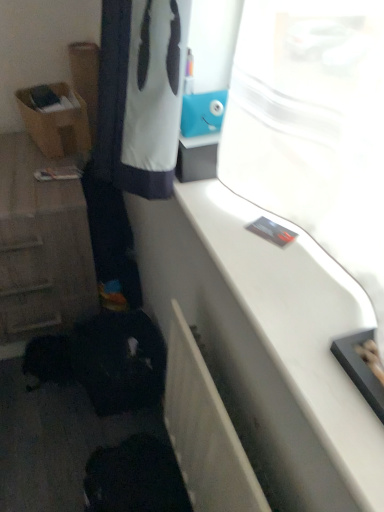
Question: Is point (1, 184) positioned closer to the camera than point (274, 349)?

Choices:
 (A) farther
 (B) closer

Answer: (A)

Question: From their relative heights in the image, would you say wooden cabinet at left is taller or shorter than white glossy counter top at upper right?

Choices:
 (A) tall
 (B) short

Answer: (A)

Question: Estimate the real-world distances between objects in this image. Which object is farther from the white glossy counter top at upper right?

Choices:
 (A) brown cardboard box at left
 (B) wooden cabinet at left

Answer: (A)

Question: Which object is positioned farthest from the wooden cabinet at left?

Choices:
 (A) brown cardboard box at left
 (B) white glossy counter top at upper right

Answer: (B)